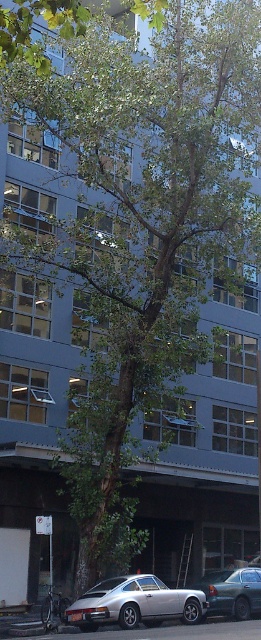
Question: Among these objects, which one is nearest to the camera?

Choices:
 (A) metallic gray sedan at center
 (B) silver metallic car at lower left

Answer: (B)

Question: Which point is closer to the camera?

Choices:
 (A) silver metallic car at lower left
 (B) metallic gray sedan at center

Answer: (A)

Question: Is silver metallic car at lower left behind metallic gray sedan at center?

Choices:
 (A) yes
 (B) no

Answer: (B)

Question: Is silver metallic car at lower left closer to camera compared to metallic gray sedan at center?

Choices:
 (A) yes
 (B) no

Answer: (A)

Question: Where is silver metallic car at lower left located in relation to metallic gray sedan at center in the image?

Choices:
 (A) above
 (B) below

Answer: (A)